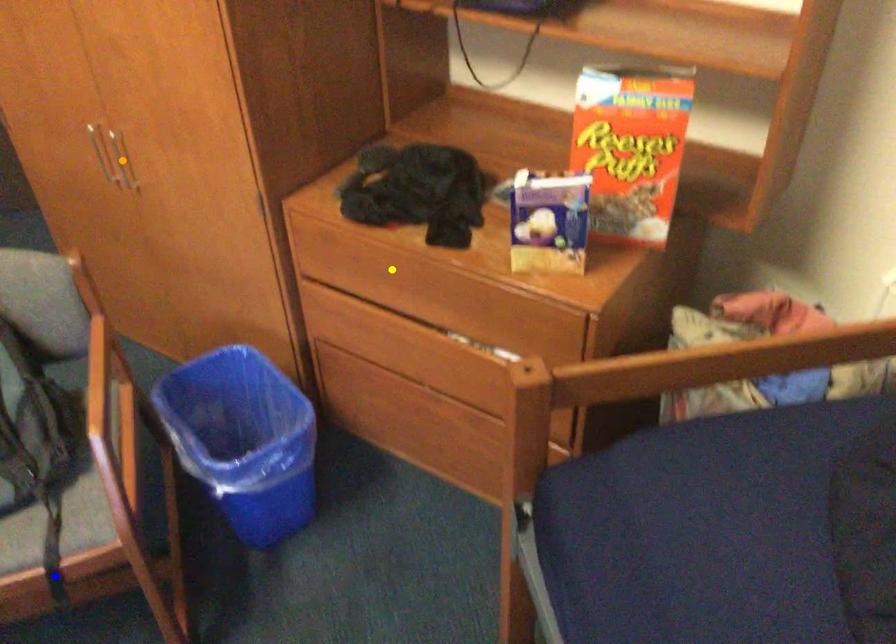
Order these from farthest to nearest:
A) orange point
B) yellow point
C) blue point

orange point, yellow point, blue point